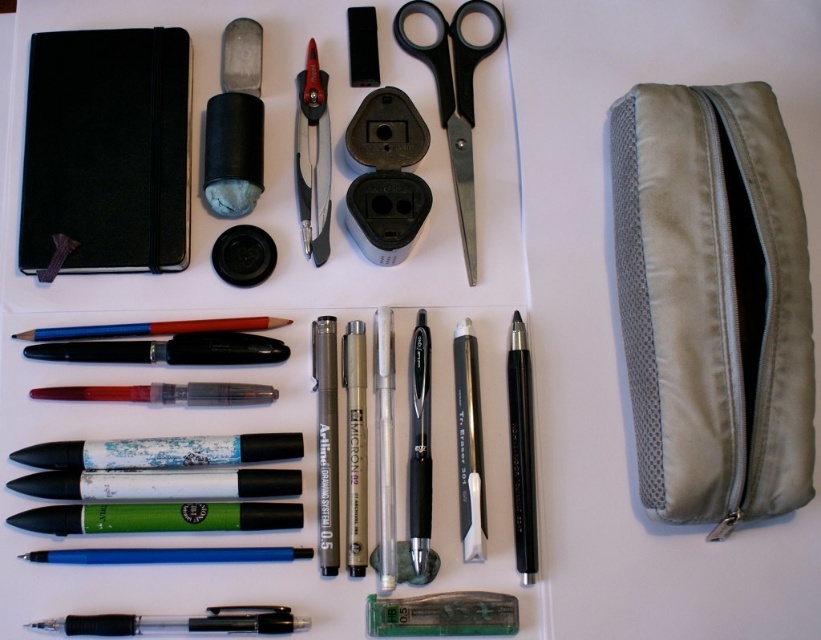
Question: Is black matte notebook at upper left bigger than black plastic scissors at upper center?

Choices:
 (A) yes
 (B) no

Answer: (A)

Question: Does olive green fabric pouch at right appear on the left side of black plastic scissors at upper center?

Choices:
 (A) yes
 (B) no

Answer: (B)

Question: Based on their relative distances, which object is farther from the black plastic scissors at upper center?

Choices:
 (A) olive green fabric pouch at right
 (B) black matte notebook at upper left

Answer: (A)

Question: Estimate the real-world distances between objects in this image. Which object is closer to the black metal scissors at upper center?

Choices:
 (A) black plastic scissors at upper center
 (B) olive green fabric pouch at right

Answer: (A)

Question: Considering the relative positions of black matte notebook at upper left and black plastic scissors at upper center in the image provided, where is black matte notebook at upper left located with respect to black plastic scissors at upper center?

Choices:
 (A) left
 (B) right

Answer: (A)

Question: Which of these objects is positioned closest to the olive green fabric pouch at right?

Choices:
 (A) black metal scissors at upper center
 (B) black plastic scissors at upper center
 (C) black matte notebook at upper left

Answer: (A)